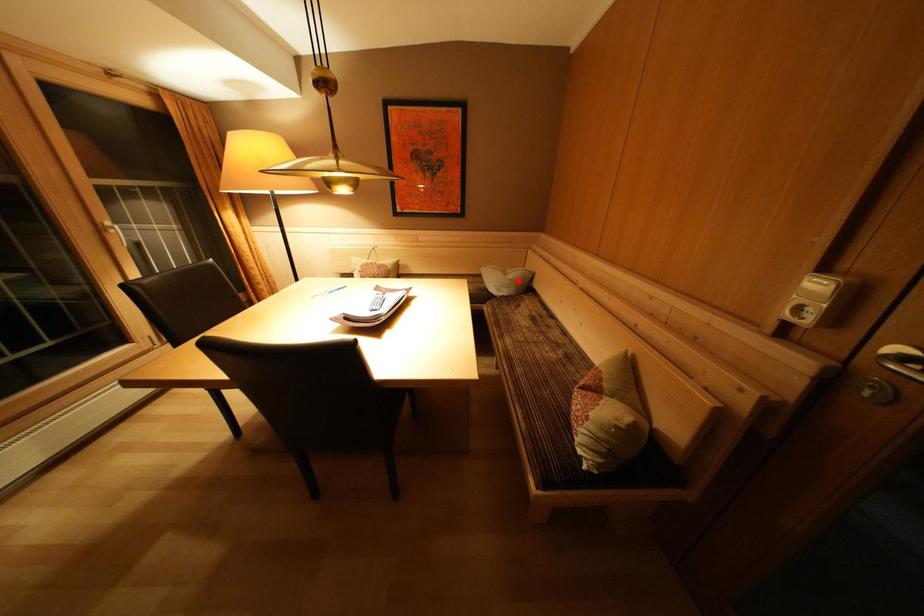
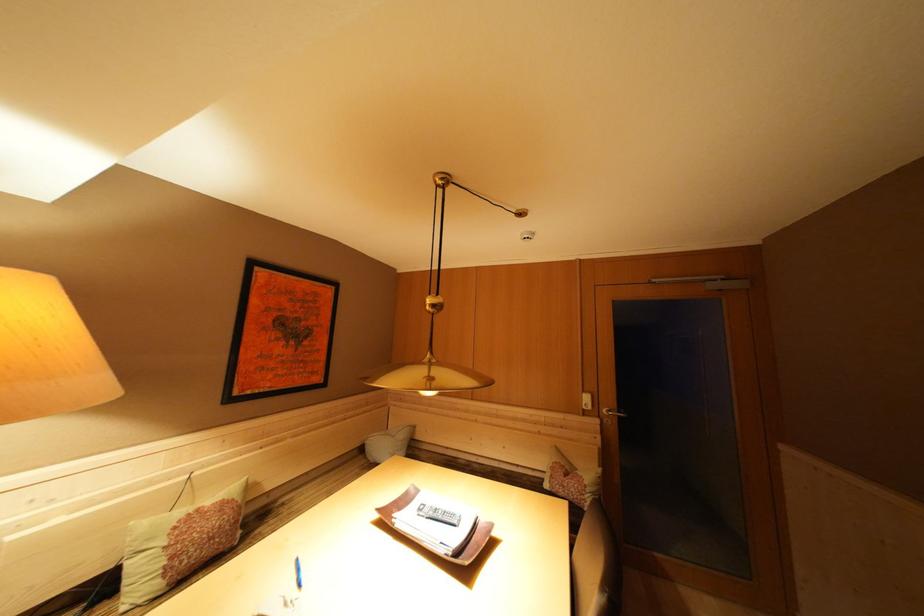
Where in the second image is the point corresponding to the highlighted location from the first image?

(408, 440)